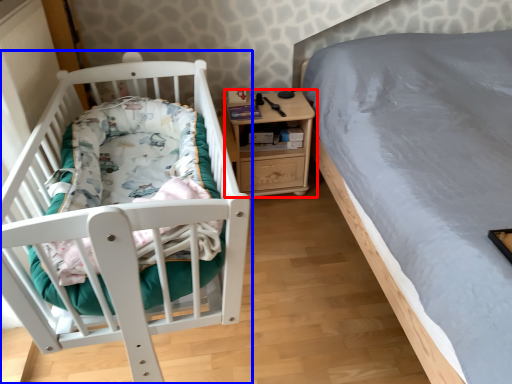
Question: Which object is further to the camera taking this photo, nightstand (highlighted by a red box) or infant bed (highlighted by a blue box)?

Choices:
 (A) nightstand
 (B) infant bed

Answer: (A)